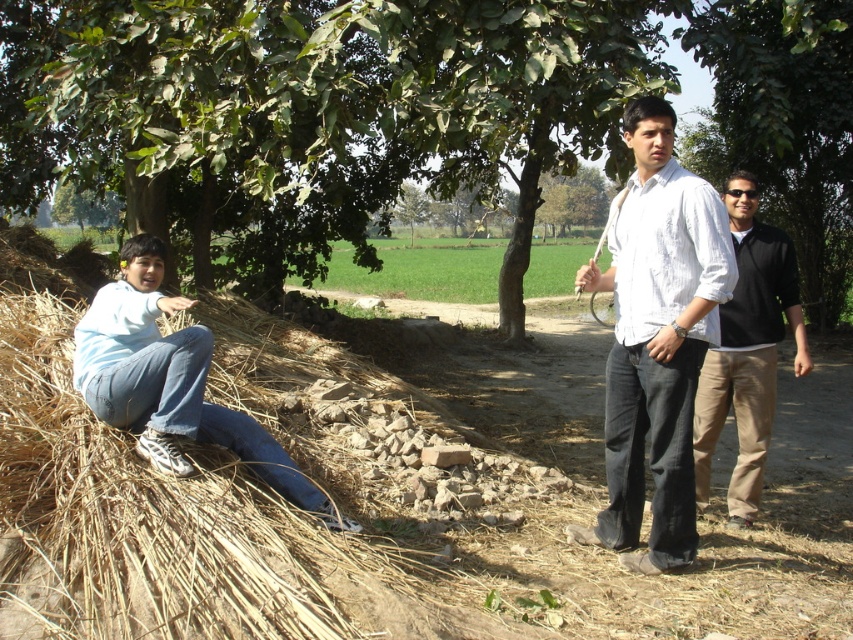
Does brown dirt field at center come behind green leafy tree at center?

No, brown dirt field at center is closer to the viewer.

Measure the distance between point [432,486] and camera.

The distance of point [432,486] from camera is 5.20 meters.

The image size is (853, 640). Describe the element at coordinates (378, 496) in the screenshot. I see `brown dirt field at center` at that location.

Where is `brown dirt field at center`? brown dirt field at center is located at coordinates [378, 496].

Is green leafy tree at upper left to the right of light blue denim jeans at left from the viewer's perspective?

Yes, green leafy tree at upper left is to the right of light blue denim jeans at left.

Is point (770, 157) behind point (231, 420)?

Yes, point (770, 157) is farther from viewer.

Where is `green leafy tree at upper left`? green leafy tree at upper left is located at coordinates (409, 116).

Is brown dirt field at center above green leafy tree at upper left?

Incorrect, brown dirt field at center is not positioned above green leafy tree at upper left.

Which is above, brown dirt field at center or green leafy tree at upper left?

green leafy tree at upper left is higher up.

Describe the element at coordinates (378, 496) in the screenshot. I see `brown dirt field at center` at that location.

At what (x,y) coordinates should I click in order to perform the action: click on brown dirt field at center. Please return your answer as a coordinate pair (x, y). The image size is (853, 640). Looking at the image, I should click on (378, 496).